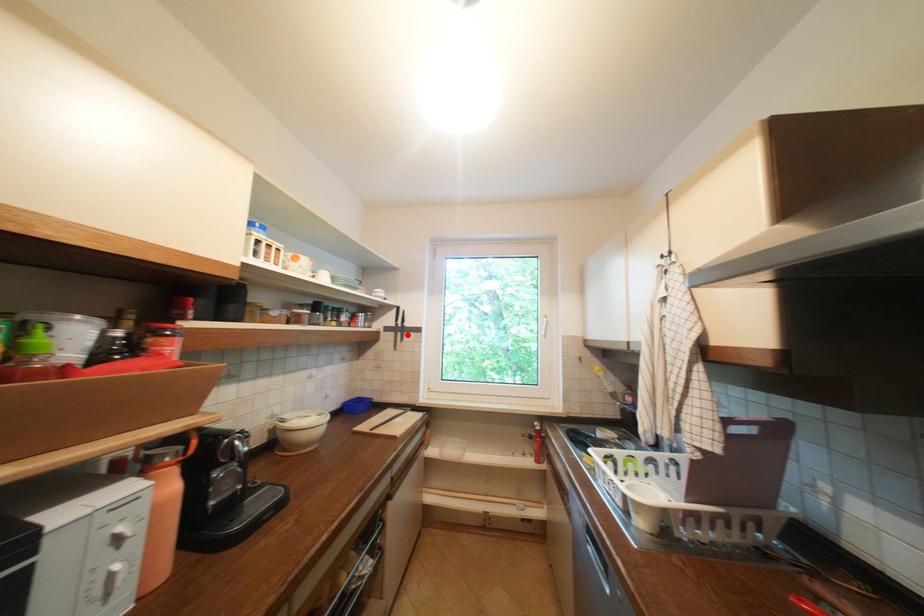
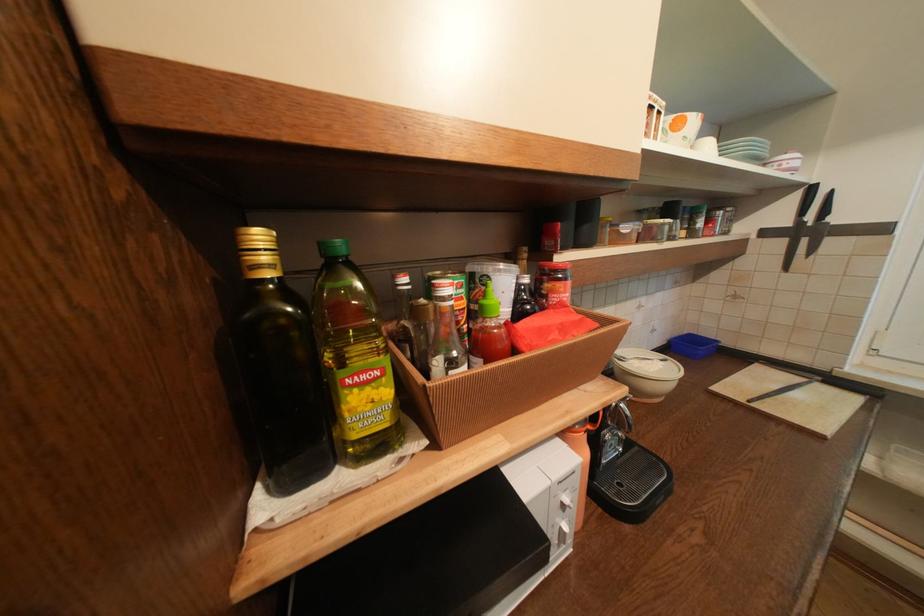
Where in the second image is the point corresponding to the highlighted location from the first image?

(812, 241)